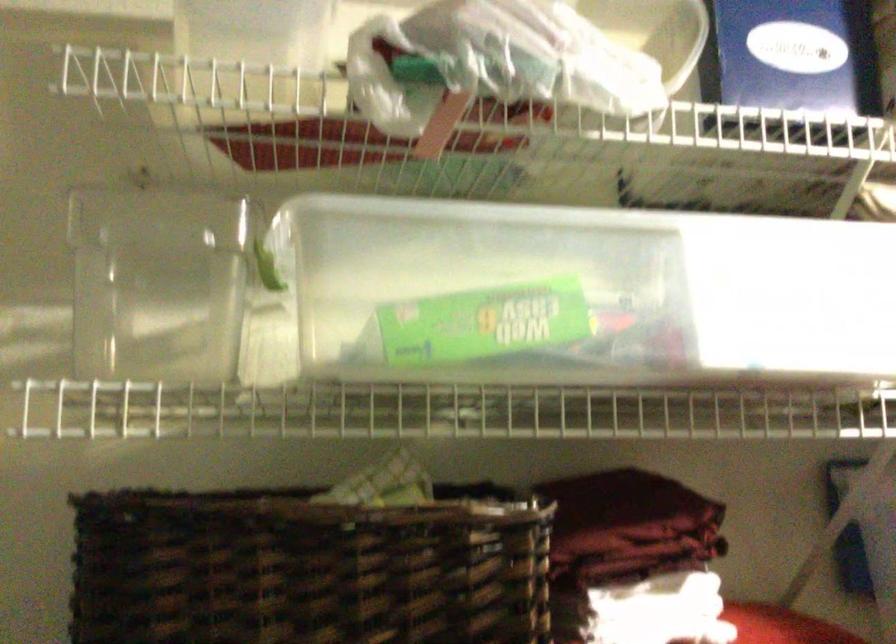
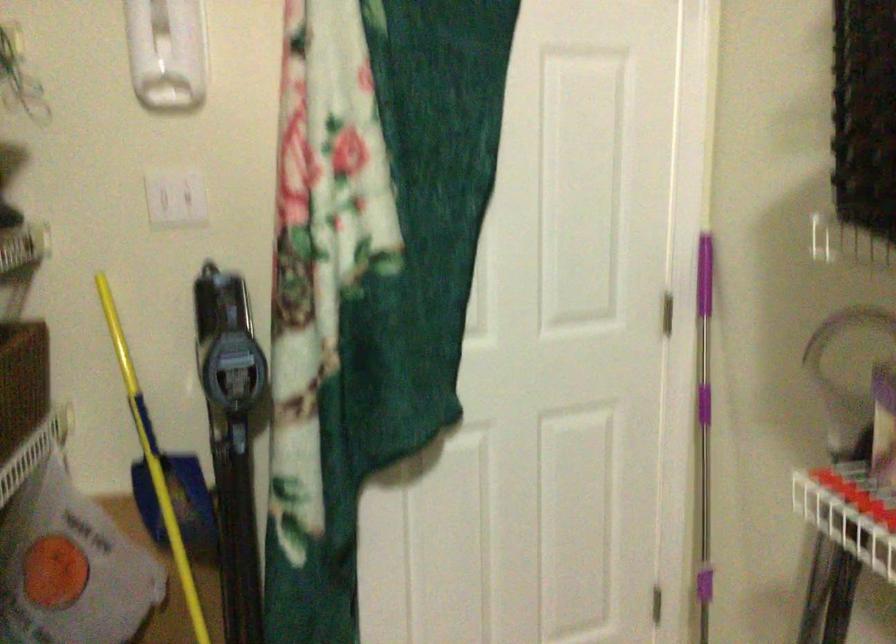
Question: The first image is from the beginning of the video and the second image is from the end. How did the camera likely rotate when shooting the video?

Choices:
 (A) Left
 (B) Right
 (C) Up
 (D) Down

Answer: (A)